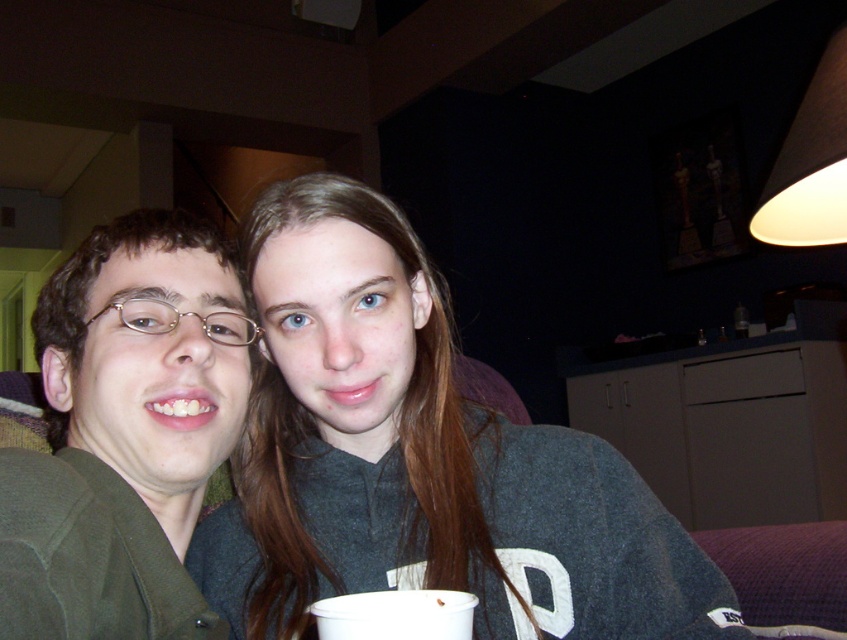
You are standing in the living room and want to reach both the point at coordinates (319, 349) and the point at coordinates (811, 193). Which point should you approach first to reach the closer one?

You should approach point (319, 349) first because it is closer to you than point (811, 193).

You are a photographer trying to capture a closeup of the white matte lampshade at upper right without including the green matte jacket at left in the frame. Is this possible given their positions?

The green matte jacket at left is closer to the viewer than the white matte lampshade at upper right, so it may block the view of the lampshade depending on the camera angle and distance. Adjusting the position or zooming in might be necessary to exclude the jacket.

You are a photographer adjusting the camera focus. You need to focus on the dark gray sweater at center and the green matte jacket at left. Which one should you focus on first if you want to ensure both are in focus without moving the camera?

The dark gray sweater at center is below the green matte jacket at left. To ensure both are in focus, you should focus on the green matte jacket at left first, as it is closer to the camera, then adjust the focus downward to include the dark gray sweater at center in the focal plane.